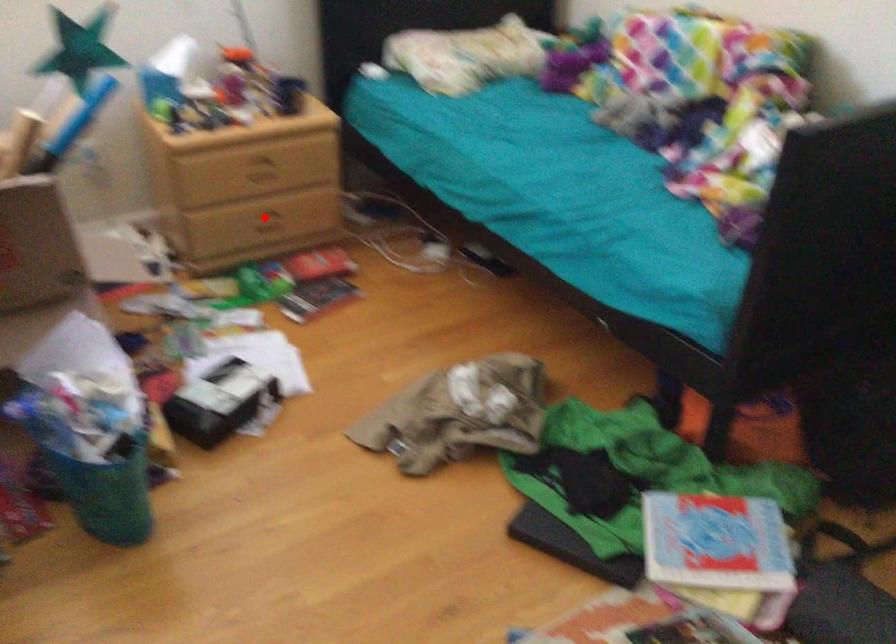
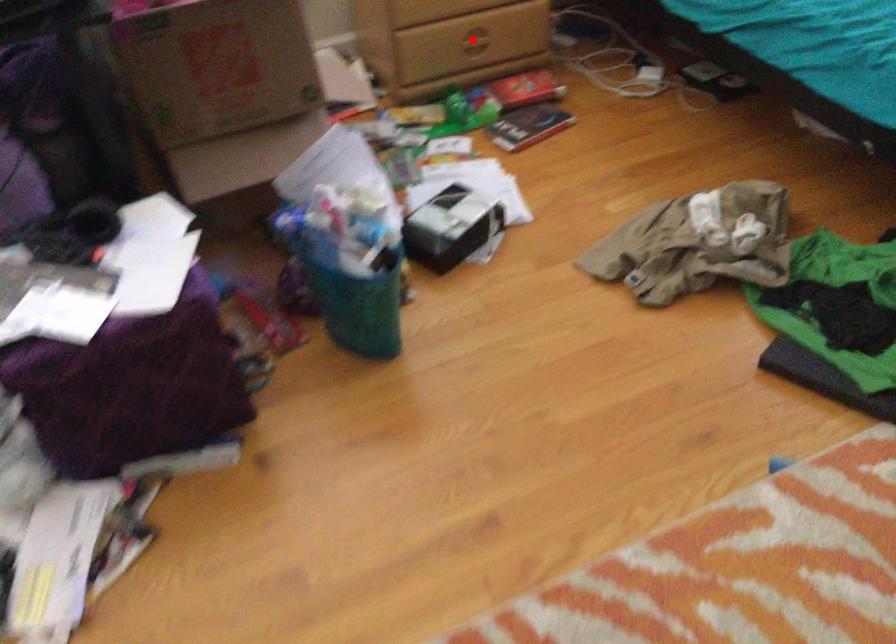
I am providing you with two images of the same scene from different viewpoints. A red point is marked on the first image and another point is marked on the second image. Does the point marked in image1 correspond to the same location as the one in image2?

Yes